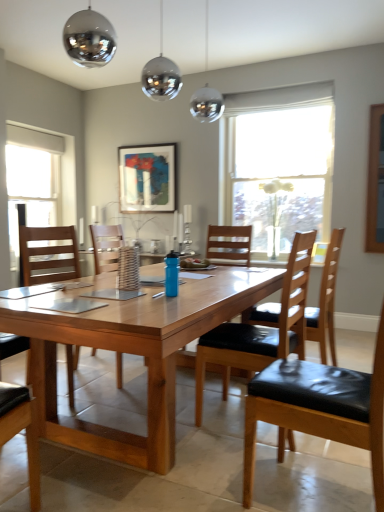
At what (x,y) coordinates should I click in order to perform the action: click on vacant space in black leather chair at right, marked as the second chair in a right-to-left arrangement (from a real-world perspective). Please return your answer as a coordinate pair (x, y). Looking at the image, I should click on (308, 492).